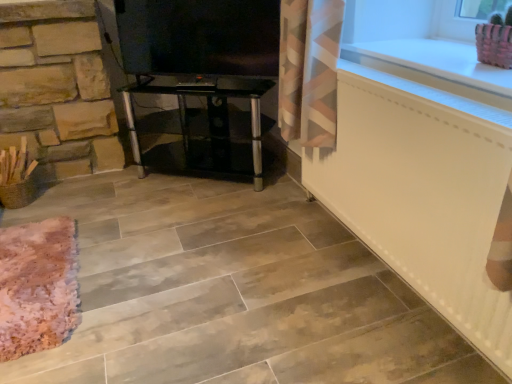
This screenshot has width=512, height=384. I want to click on pink fabric basket at upper right, so click(463, 17).

The width and height of the screenshot is (512, 384). Describe the element at coordinates (434, 65) in the screenshot. I see `white glossy counter top at upper right` at that location.

This screenshot has width=512, height=384. Describe the element at coordinates (196, 95) in the screenshot. I see `black glass tv stand at center` at that location.

The height and width of the screenshot is (384, 512). In order to click on pink fabric basket at upper right in this screenshot , I will do `click(463, 17)`.

Is pink fabric basket at upper right oriented away from white matte radiator at lower right?

No, pink fabric basket at upper right's orientation is not away from white matte radiator at lower right.

From the image's perspective, which one is positioned higher, pink fabric basket at upper right or white matte radiator at lower right?

pink fabric basket at upper right, from the image's perspective.

Can you confirm if pink fabric basket at upper right is smaller than white matte radiator at lower right?

Yes, pink fabric basket at upper right is smaller than white matte radiator at lower right.

Is pink fabric basket at upper right not near white glossy counter top at upper right?

No, there isn't a large distance between pink fabric basket at upper right and white glossy counter top at upper right.

From the image's perspective, is pink fabric basket at upper right above white glossy counter top at upper right?

Yes.

From a real-world perspective, is pink fabric basket at upper right over white glossy counter top at upper right?

Yes, from a real-world perspective, pink fabric basket at upper right is on top of white glossy counter top at upper right.

Considering the positions of objects white glossy counter top at upper right and black glass tv stand at center in the image provided, who is more to the right, white glossy counter top at upper right or black glass tv stand at center?

white glossy counter top at upper right is more to the right.

Between white glossy counter top at upper right and black glass tv stand at center, which one has more height?

black glass tv stand at center.

From the image's perspective, between white glossy counter top at upper right and black glass tv stand at center, which one is located above?

white glossy counter top at upper right, from the image's perspective.

Are white glossy counter top at upper right and pink fabric basket at upper right making contact?

They are not placed beside each other.

Identify the location of counter top below the pink fabric basket at upper right (from the image's perspective). This screenshot has height=384, width=512. (434, 65).

From a real-world perspective, which object stands above the other?

From a 3D spatial view, pink fabric basket at upper right is above.

From the image's perspective, which is below, white glossy counter top at upper right or pink fabric basket at upper right?

white glossy counter top at upper right.

Is black glass tv stand at center at the back of pink fabric basket at upper right?

No, pink fabric basket at upper right is not facing the opposite direction of black glass tv stand at center.

From the image's perspective, does pink fabric basket at upper right appear lower than black glass tv stand at center?

Actually, pink fabric basket at upper right appears above black glass tv stand at center in the image.

Is pink fabric basket at upper right not close to black glass tv stand at center?

pink fabric basket at upper right is positioned a significant distance from black glass tv stand at center.

Can you confirm if pink fabric basket at upper right is smaller than black glass tv stand at center?

Yes, pink fabric basket at upper right is smaller than black glass tv stand at center.

Is black glass tv stand at center turned away from white glossy counter top at upper right?

That's not correct — black glass tv stand at center is not looking away from white glossy counter top at upper right.

Identify the location of furniture located below the white glossy counter top at upper right (from the image's perspective). The image size is (512, 384). (196, 95).

Which is less distant, (128, 101) or (419, 47)?

Point (128, 101) is farther from the camera than point (419, 47).

Is black glass tv stand at center thinner than white glossy counter top at upper right?

Yes, black glass tv stand at center is thinner than white glossy counter top at upper right.

This screenshot has height=384, width=512. Identify the location of radiator beneath the white glossy counter top at upper right (from a real-world perspective). (423, 192).

From a real-world perspective, which object rests below the other?

white matte radiator at lower right, from a real-world perspective.

From the image's perspective, is white glossy counter top at upper right under white matte radiator at lower right?

Incorrect, from the image's perspective, white glossy counter top at upper right is higher than white matte radiator at lower right.

Which is behind, point (470, 59) or point (490, 325)?

Positioned behind is point (470, 59).

Locate an element on the screen. radiator on the left side of pink fabric basket at upper right is located at coordinates (423, 192).

Identify the location of window frame on the right of white glossy counter top at upper right. (463, 17).

Considering their positions, is white matte radiator at lower right positioned further to black glass tv stand at center than white glossy counter top at upper right?

Based on the image, white glossy counter top at upper right appears to be further to black glass tv stand at center.

Estimate the real-world distances between objects in this image. Which object is closer to white glossy counter top at upper right, pink fabric basket at upper right or white matte radiator at lower right?

Among the two, white matte radiator at lower right is located nearer to white glossy counter top at upper right.

When comparing their distances from white matte radiator at lower right, does white glossy counter top at upper right or pink fabric basket at upper right seem further?

Among the two, pink fabric basket at upper right is located further to white matte radiator at lower right.

When comparing their distances from pink fabric basket at upper right, does white matte radiator at lower right or black glass tv stand at center seem closer?

The object closer to pink fabric basket at upper right is white matte radiator at lower right.

Which object lies further to the anchor point white matte radiator at lower right, pink fabric basket at upper right or black glass tv stand at center?

black glass tv stand at center is further to white matte radiator at lower right.

Which object lies further to the anchor point black glass tv stand at center, white glossy counter top at upper right or pink fabric basket at upper right?

pink fabric basket at upper right is positioned further to the anchor black glass tv stand at center.

Considering their positions, is pink fabric basket at upper right positioned further to black glass tv stand at center than white glossy counter top at upper right?

pink fabric basket at upper right is positioned further to the anchor black glass tv stand at center.

Based on their spatial positions, is white glossy counter top at upper right or black glass tv stand at center further from pink fabric basket at upper right?

black glass tv stand at center is further to pink fabric basket at upper right.

Where is `counter top between pink fabric basket at upper right and white matte radiator at lower right vertically`? counter top between pink fabric basket at upper right and white matte radiator at lower right vertically is located at coordinates (434, 65).

The width and height of the screenshot is (512, 384). Find the location of `counter top between white matte radiator at lower right and black glass tv stand at center from front to back`. counter top between white matte radiator at lower right and black glass tv stand at center from front to back is located at coordinates (434, 65).

What are the coordinates of `window frame between white matte radiator at lower right and black glass tv stand at center from front to back` in the screenshot? It's located at (463, 17).

Locate an element on the screen. counter top between black glass tv stand at center and pink fabric basket at upper right in the horizontal direction is located at coordinates (434, 65).